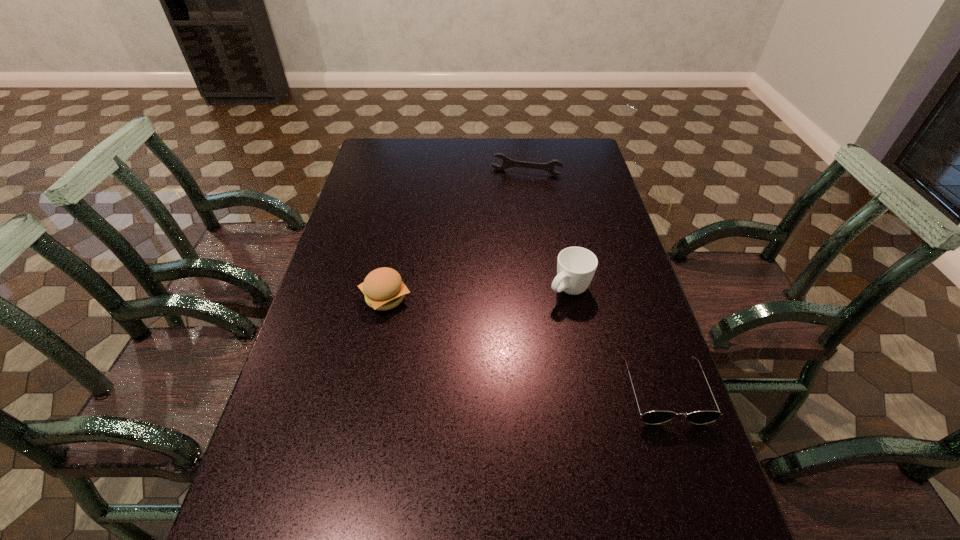
At what (x,y) coordinates should I click in order to perform the action: click on vacant area situated 0.310m on the open ends of the wrench. Please return your answer as a coordinate pair (x, y). Looking at the image, I should click on (506, 228).

I want to click on free spot located 0.080m with the handle on the side of the cup, so click(537, 318).

Find the location of `vacant space situated with the handle on the side of the cup`. vacant space situated with the handle on the side of the cup is located at coordinates tap(537, 318).

You are a GUI agent. You are given a task and a screenshot of the screen. Output one action in this format:
    pyautogui.click(x=<x>, y=<y>)
    Task: Click on the vacant space located with the handle on the side of the cup
    
    Given the screenshot: What is the action you would take?
    pyautogui.click(x=466, y=379)

At what (x,y) coordinates should I click in order to perform the action: click on object that is at the far edge. Please return your answer as a coordinate pair (x, y). The image size is (960, 540). Looking at the image, I should click on (507, 162).

Image resolution: width=960 pixels, height=540 pixels. I want to click on object situated at the left edge, so click(x=383, y=288).

Find the location of a particular element. Image resolution: width=960 pixels, height=540 pixels. sunglasses located at the right edge is located at coordinates (652, 417).

Image resolution: width=960 pixels, height=540 pixels. In order to click on wrench positioned at the right edge in this screenshot , I will do `click(507, 162)`.

Find the location of a particular element. This screenshot has width=960, height=540. cup that is positioned at the right edge is located at coordinates (576, 266).

The height and width of the screenshot is (540, 960). In order to click on object at the far right corner in this screenshot , I will do `click(507, 162)`.